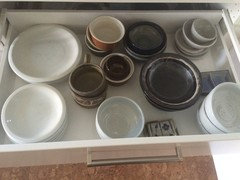
Image resolution: width=240 pixels, height=180 pixels. What are the coordinates of `stack of black plates` in the screenshot? It's located at (173, 105).